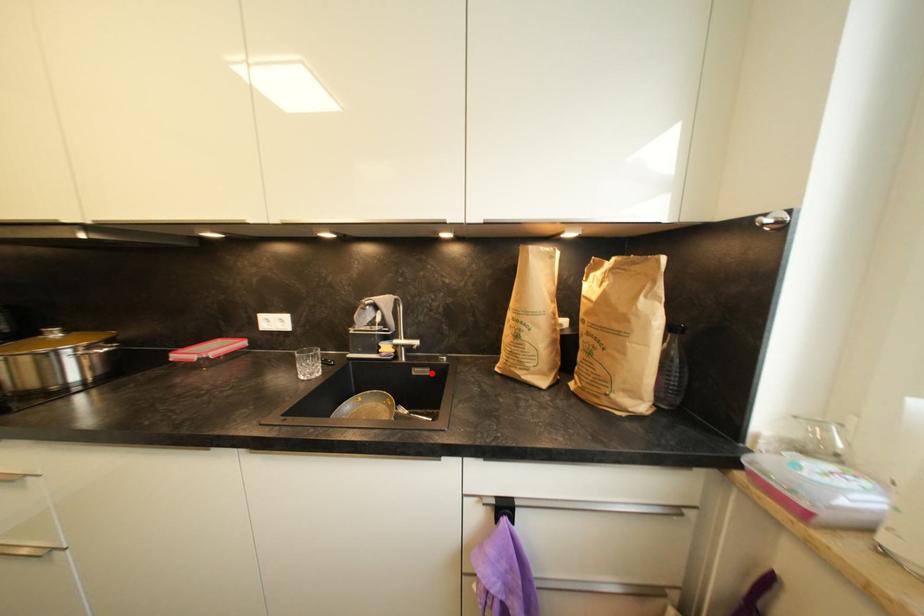
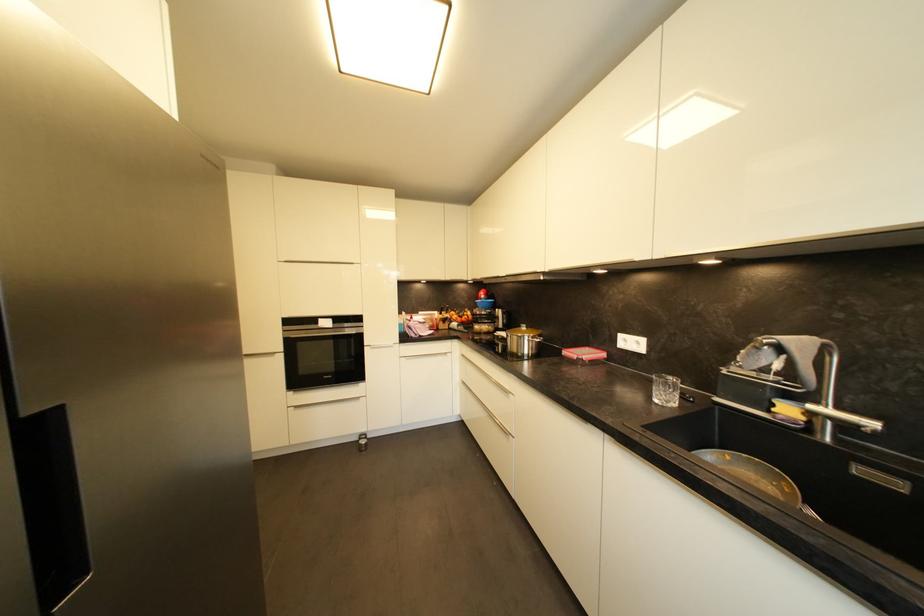
In the second image, find the point that corresponds to the highlighted location in the first image.

(904, 487)